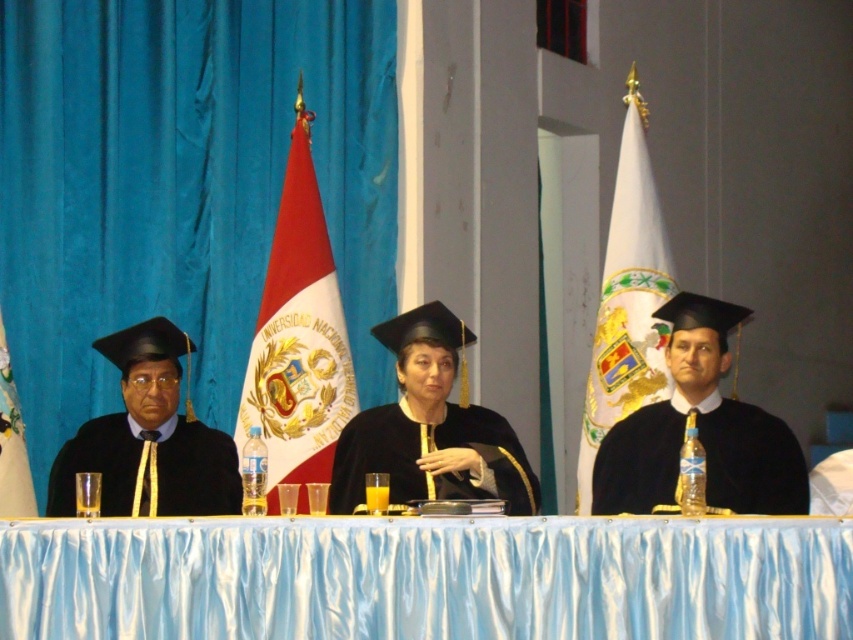
Question: Is silky blue tablecloth at center smaller than matte black graduation gown at left?

Choices:
 (A) yes
 (B) no

Answer: (B)

Question: Which of the following is the farthest from the observer?

Choices:
 (A) white glossy flag at center
 (B) black matte graduation gown at center
 (C) matte black graduation gown at left

Answer: (A)

Question: Which point is farther to the camera?

Choices:
 (A) black matte graduation gown at center
 (B) white glossy flag at center
 (C) matte black graduation gown at left
 (D) silky blue tablecloth at center

Answer: (B)

Question: Considering the relative positions of silky blue tablecloth at center and matte black graduation gown at left in the image provided, where is silky blue tablecloth at center located with respect to matte black graduation gown at left?

Choices:
 (A) right
 (B) left

Answer: (A)

Question: Does silky blue tablecloth at center appear under white glossy flag at center?

Choices:
 (A) yes
 (B) no

Answer: (B)

Question: Among these points, which one is farthest from the camera?

Choices:
 (A) (294, 234)
 (B) (761, 618)

Answer: (A)